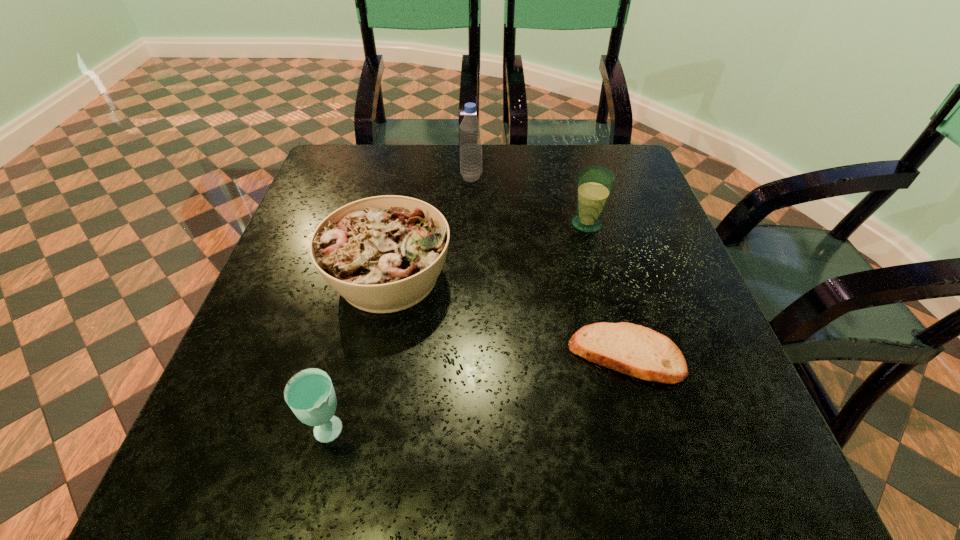
Where is `vacant space located on the left of the nearer glass`? This screenshot has width=960, height=540. vacant space located on the left of the nearer glass is located at coordinates (210, 433).

I want to click on free space located on the back of the salad, so click(x=405, y=198).

Identify the location of vacant space located 0.280m on the back of the shortest object. The height and width of the screenshot is (540, 960). (592, 232).

I want to click on object that is at the far edge, so click(x=470, y=130).

The width and height of the screenshot is (960, 540). Identify the location of object located at the near edge. (309, 393).

You are a GUI agent. You are given a task and a screenshot of the screen. Output one action in this format:
    pyautogui.click(x=<x>, y=<y>)
    Task: Click on the object present at the left edge
    This screenshot has height=540, width=960.
    Given the screenshot: What is the action you would take?
    [383, 254]

At what (x,y) coordinates should I click in order to perform the action: click on glass located at the right edge. Please return your answer as a coordinate pair (x, y). The width and height of the screenshot is (960, 540). Looking at the image, I should click on (595, 183).

The height and width of the screenshot is (540, 960). What are the coordinates of `pita bread located in the right edge section of the desktop` in the screenshot? It's located at (634, 350).

This screenshot has width=960, height=540. What are the coordinates of `vacant region at the far edge of the desktop` in the screenshot? It's located at (538, 166).

Find the location of `vacant space at the near edge of the desktop`. vacant space at the near edge of the desktop is located at coordinates (394, 464).